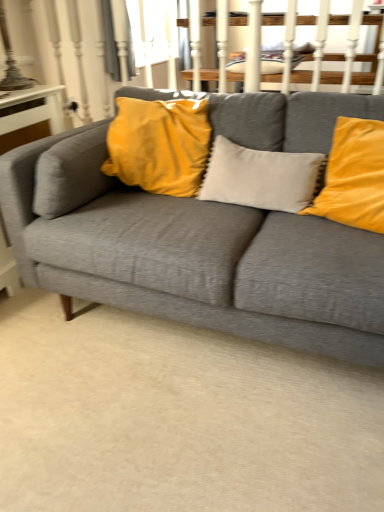
What do you see at coordinates (191, 254) in the screenshot?
I see `textured gray couch at center` at bounding box center [191, 254].

This screenshot has height=512, width=384. Find the location of `textured gray couch at center`. textured gray couch at center is located at coordinates (191, 254).

Image resolution: width=384 pixels, height=512 pixels. I want to click on textured gray couch at center, so click(191, 254).